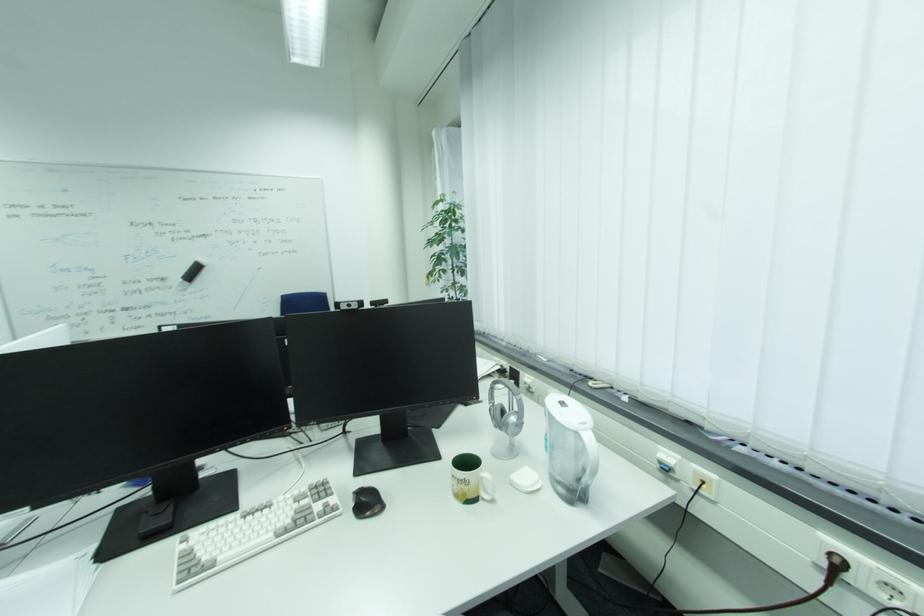
Image resolution: width=924 pixels, height=616 pixels. I want to click on blue power switch, so point(665,469).